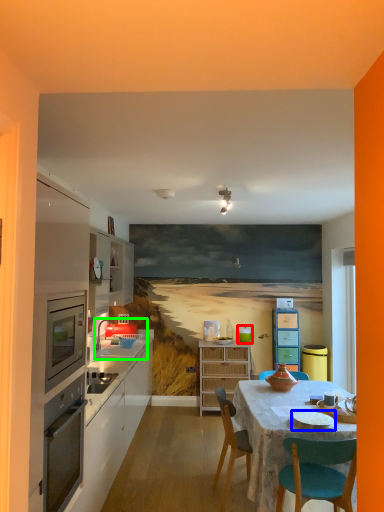
Question: Estimate the real-world distances between objects in this image. Which object is closer to teal (highlighted by a red box), tableware (highlighted by a blue box) or sink (highlighted by a green box)?

Choices:
 (A) tableware
 (B) sink

Answer: (B)